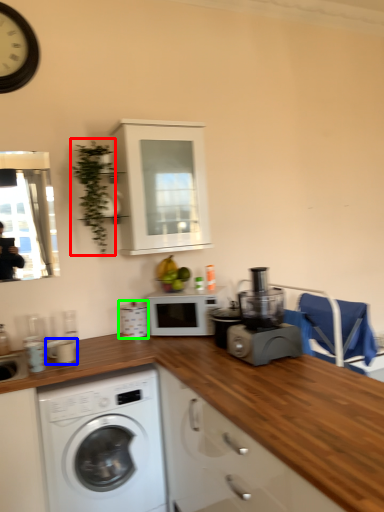
Question: Based on their relative distances, which object is nearer to plant (highlighted by a red box)? Choose from appliance (highlighted by a blue box) and appliance (highlighted by a green box).

Choices:
 (A) appliance
 (B) appliance

Answer: (B)